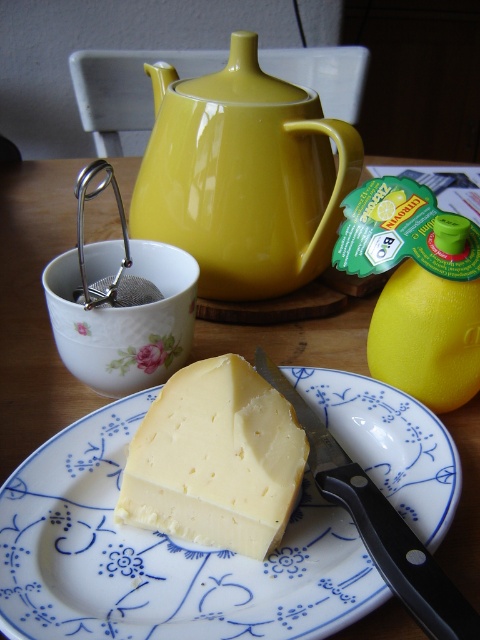
You are a person with a height of 6 feet. You are standing in front of the table shown in the image. There is a point at coordinates point (187, 474). Can you reach that point with your hand?

The distance between the point (187, 474) and the viewer is 12.29 inches. Since the average person can reach about 24 inches in front of them, you can easily reach the point with your hand.